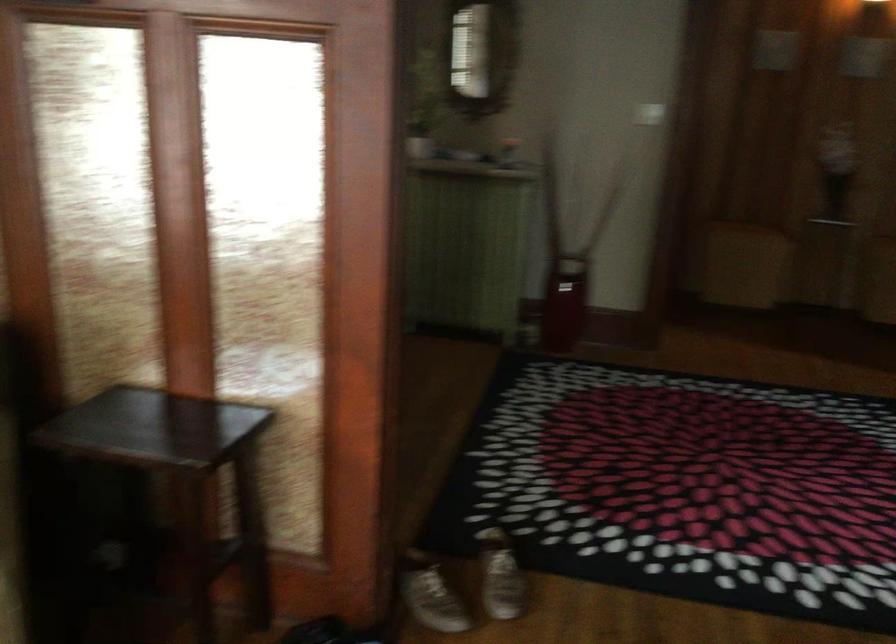
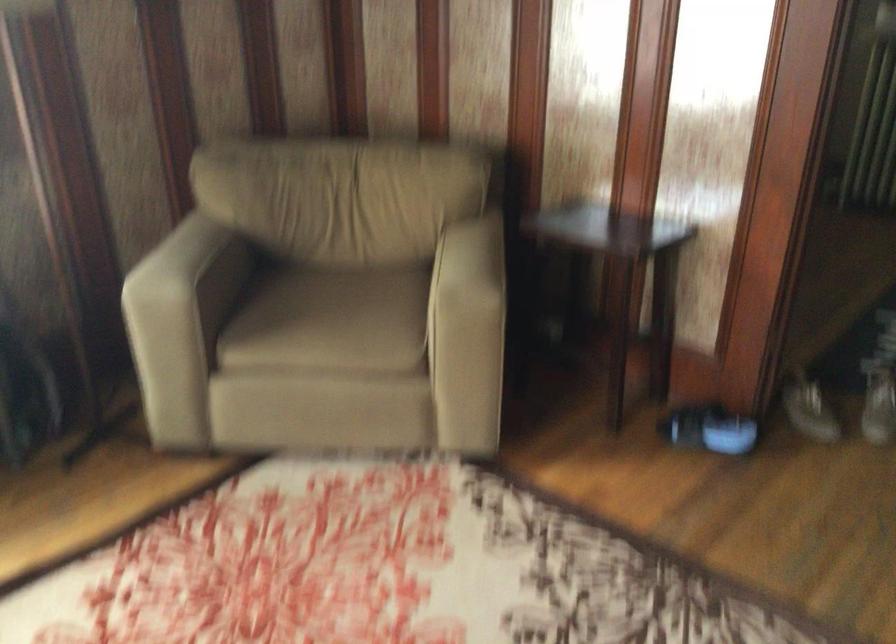
Question: The images are taken continuously from a first-person perspective. In which direction is your viewpoint rotating?

Choices:
 (A) Left
 (B) Right
 (C) Up
 (D) Down

Answer: (A)